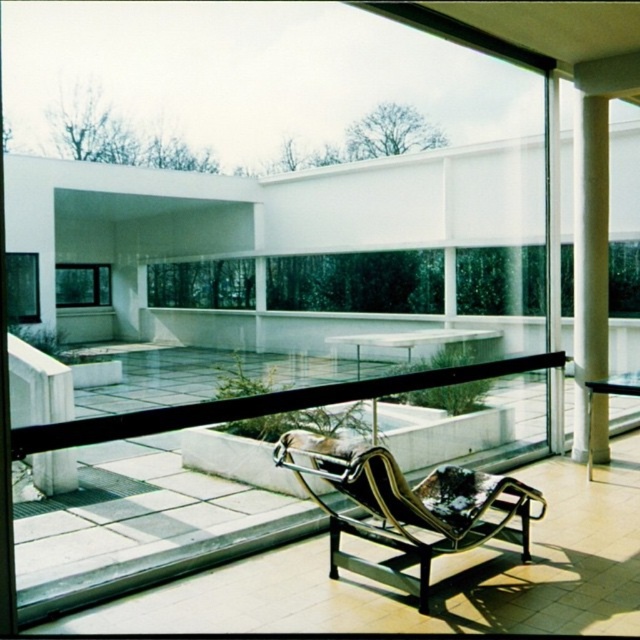
Is point (369, 460) closer to viewer compared to point (88, 289)?

Yes.

Does metallic black chaise lounge at lower center have a lesser height compared to clear glass window at upper left?

Correct, metallic black chaise lounge at lower center is not as tall as clear glass window at upper left.

Locate an element on the screen. metallic black chaise lounge at lower center is located at coordinates (406, 508).

Identify the location of metallic black chaise lounge at lower center. (406, 508).

Is metallic black chaise lounge at lower center shorter than white concrete column at right?

Correct, metallic black chaise lounge at lower center is not as tall as white concrete column at right.

Does metallic black chaise lounge at lower center have a smaller size compared to white concrete column at right?

No.

Which is behind, point (429, 506) or point (589, 182)?

The point (589, 182) is more distant.

You are a GUI agent. You are given a task and a screenshot of the screen. Output one action in this format:
    pyautogui.click(x=<x>, y=<y>)
    Task: Click on the metallic black chaise lounge at lower center
    This screenshot has width=640, height=640.
    Given the screenshot: What is the action you would take?
    pyautogui.click(x=406, y=508)

Which is below, white concrete column at right or transparent glass window at lower left?

Positioned lower is white concrete column at right.

What do you see at coordinates (589, 256) in the screenshot? The width and height of the screenshot is (640, 640). I see `white concrete column at right` at bounding box center [589, 256].

Locate an element on the screen. Image resolution: width=640 pixels, height=640 pixels. white concrete column at right is located at coordinates (589, 256).